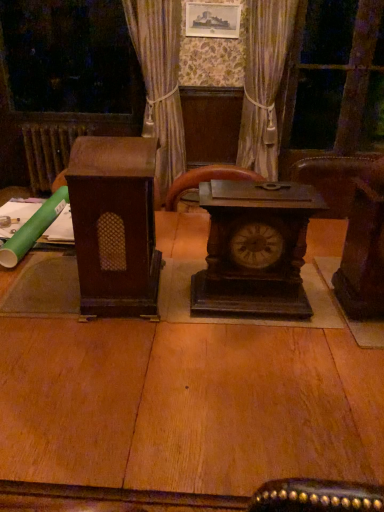
Describe the element at coordinates (353, 226) in the screenshot. I see `dark wood chair at right, the 1th furniture when ordered from right to left` at that location.

The width and height of the screenshot is (384, 512). What do you see at coordinates (49, 150) in the screenshot?
I see `brown wooden radiator at left` at bounding box center [49, 150].

Where is `brown wooden radiator at left`? This screenshot has height=512, width=384. brown wooden radiator at left is located at coordinates [49, 150].

The image size is (384, 512). Describe the element at coordinates (265, 84) in the screenshot. I see `silky beige curtain at center` at that location.

Image resolution: width=384 pixels, height=512 pixels. In order to click on silky beige curtain at center in this screenshot , I will do `click(265, 84)`.

At what (x,y) coordinates should I click in order to perform the action: click on transparent glass door at upper right. Please return your answer as a coordinate pair (x, y). The width and height of the screenshot is (384, 512). Looking at the image, I should click on (330, 72).

The width and height of the screenshot is (384, 512). In order to click on dark brown wood clock at center in this screenshot , I will do `click(254, 249)`.

Choose the correct answer: Is dark wood chair at right, which is counted as the second furniture, starting from the left, inside silky beige curtain at center or outside it?

dark wood chair at right, which is counted as the second furniture, starting from the left, cannot be found inside silky beige curtain at center.

In terms of height, does dark wood chair at right, the 1th furniture when ordered from right to left, look taller or shorter compared to silky beige curtain at center?

dark wood chair at right, the 1th furniture when ordered from right to left, is shorter than silky beige curtain at center.

Can you confirm if dark wood chair at right, the 1th furniture when ordered from right to left, is smaller than silky beige curtain at center?

Correct, dark wood chair at right, the 1th furniture when ordered from right to left, occupies less space than silky beige curtain at center.

Relative to silky beige curtain at center, is dark wood chair at right, which is counted as the second furniture, starting from the left, in front or behind?

dark wood chair at right, which is counted as the second furniture, starting from the left, is positioned closer to the viewer than silky beige curtain at center.

From the image's perspective, which one is positioned higher, dark wood chair at right, the 1th furniture when ordered from right to left, or brown wooden radiator at left?

brown wooden radiator at left.

From the picture: Does dark wood chair at right, the 1th furniture when ordered from right to left, have a smaller size compared to brown wooden radiator at left?

Indeed, dark wood chair at right, the 1th furniture when ordered from right to left, has a smaller size compared to brown wooden radiator at left.

Which of these two, dark wood chair at right, which is counted as the second furniture, starting from the left, or brown wooden radiator at left, is thinner?

With smaller width is dark wood chair at right, which is counted as the second furniture, starting from the left.

Between dark wood chair at right, the 1th furniture when ordered from right to left, and brown wooden radiator at left, which one appears on the right side from the viewer's perspective?

Positioned to the right is dark wood chair at right, the 1th furniture when ordered from right to left.

Which object is thinner, brown wooden radiator at left or dark wood chair at right, the 1th furniture when ordered from right to left?

Thinner between the two is dark wood chair at right, the 1th furniture when ordered from right to left.

How far apart are brown wooden radiator at left and dark wood chair at right, the 1th furniture when ordered from right to left?

brown wooden radiator at left and dark wood chair at right, the 1th furniture when ordered from right to left, are 8.63 feet apart from each other.

Considering the positions of points (31, 125) and (373, 250), is point (31, 125) closer to camera compared to point (373, 250)?

No.

Between brown wooden radiator at left and dark wood chair at right, the 1th furniture when ordered from right to left, which one is positioned behind?

brown wooden radiator at left is more distant.

From a real-world perspective, who is located higher, transparent glass door at upper right or dark wood chair at right, the 1th furniture when ordered from right to left?

dark wood chair at right, the 1th furniture when ordered from right to left.

From the image's perspective, does transparent glass door at upper right appear lower than dark wood chair at right, which is counted as the second furniture, starting from the left?

No, from the image's perspective, transparent glass door at upper right is not below dark wood chair at right, which is counted as the second furniture, starting from the left.

Is transparent glass door at upper right beside dark wood chair at right, the 1th furniture when ordered from right to left?

transparent glass door at upper right and dark wood chair at right, the 1th furniture when ordered from right to left, are not in contact.

The width and height of the screenshot is (384, 512). In order to click on the 1st furniture directly above the transparent glass door at upper right (from a real-world perspective) in this screenshot , I will do `click(353, 226)`.

Is dark brown wood clock at center inside or outside of brown wood speaker at left, the 1th furniture viewed from the left?

dark brown wood clock at center is not inside brown wood speaker at left, the 1th furniture viewed from the left, it's outside.

Considering the relative sizes of dark brown wood clock at center and brown wood speaker at left, which appears as the second furniture when viewed from the right, in the image provided, is dark brown wood clock at center shorter than brown wood speaker at left, which appears as the second furniture when viewed from the right,?

Indeed, dark brown wood clock at center has a lesser height compared to brown wood speaker at left, which appears as the second furniture when viewed from the right.

Based on the photo, from a real-world perspective, is dark brown wood clock at center positioned under brown wood speaker at left, the 1th furniture viewed from the left, based on gravity?

Yes, from a real-world perspective, dark brown wood clock at center is under brown wood speaker at left, the 1th furniture viewed from the left.

In the scene shown: Is dark brown wood clock at center thinner than brown wood speaker at left, the 1th furniture viewed from the left?

Yes, dark brown wood clock at center is thinner than brown wood speaker at left, the 1th furniture viewed from the left.

Which is behind, transparent glass door at upper right or silky beige curtain at center?

transparent glass door at upper right is further from the camera.

Does point (306, 66) come closer to viewer compared to point (287, 79)?

No, (306, 66) is further to viewer.

Identify the location of curtain in front of the transparent glass door at upper right. The width and height of the screenshot is (384, 512). (265, 84).

Looking at this image, is transparent glass door at upper right aimed at silky beige curtain at center?

No, transparent glass door at upper right does not turn towards silky beige curtain at center.

Which of these two, transparent glass door at upper right or brown wooden radiator at left, stands taller?

transparent glass door at upper right.

From a real-world perspective, is transparent glass door at upper right on brown wooden radiator at left?

Indeed, from a real-world perspective, transparent glass door at upper right stands above brown wooden radiator at left.

From the image's perspective, which is below, transparent glass door at upper right or brown wooden radiator at left?

brown wooden radiator at left is shown below in the image.

Locate an element on the screen. The image size is (384, 512). the 1st furniture to the left when counting from the silky beige curtain at center is located at coordinates click(x=353, y=226).

Find the location of a particular element. Image resolution: width=384 pixels, height=512 pixels. radiator that is behind the dark wood chair at right, which is counted as the second furniture, starting from the left is located at coordinates (49, 150).

When comparing their distances from dark wood chair at right, which is counted as the second furniture, starting from the left, does silky beige curtain at center or transparent glass door at upper right seem further?

transparent glass door at upper right is further to dark wood chair at right, which is counted as the second furniture, starting from the left.

Looking at the image, which one is located further to transparent glass door at upper right, brown wooden radiator at left or silky beige curtain at center?

Among the two, brown wooden radiator at left is located further to transparent glass door at upper right.

In the scene shown: Looking at the image, which one is located further to silky beige curtain at center, dark brown wood clock at center or dark wood chair at right, the 1th furniture when ordered from right to left?

dark brown wood clock at center.

Which object lies further to the anchor point silky beige curtain at center, brown wooden radiator at left or dark brown wood clock at center?

dark brown wood clock at center lies further to silky beige curtain at center than the other object.

When comparing their distances from silky beige curtain at center, does brown wood speaker at left, the 1th furniture viewed from the left, or transparent glass door at upper right seem further?

brown wood speaker at left, the 1th furniture viewed from the left.

From the image, which object appears to be nearer to dark wood chair at right, which is counted as the second furniture, starting from the left, dark brown wood clock at center or brown wood speaker at left, which appears as the second furniture when viewed from the right?

dark brown wood clock at center.

Looking at the image, which one is located closer to transparent glass door at upper right, dark brown wood clock at center or brown wood speaker at left, the 1th furniture viewed from the left?

Among the two, dark brown wood clock at center is located nearer to transparent glass door at upper right.

Looking at this image, estimate the real-world distances between objects in this image. Which object is closer to silky beige curtain at center, dark brown wood clock at center or brown wood speaker at left, which appears as the second furniture when viewed from the right?

dark brown wood clock at center lies closer to silky beige curtain at center than the other object.

In order to click on glass door between brown wood speaker at left, the 1th furniture viewed from the left, and brown wooden radiator at left from front to back in this screenshot , I will do `click(330, 72)`.

This screenshot has width=384, height=512. What are the coordinates of `curtain between brown wood speaker at left, which appears as the second furniture when viewed from the right, and transparent glass door at upper right, along the z-axis` in the screenshot? It's located at (265, 84).

This screenshot has width=384, height=512. What are the coordinates of `curtain between dark brown wood clock at center and brown wooden radiator at left from front to back` in the screenshot? It's located at (265, 84).

Where is `curtain situated between brown wooden radiator at left and transparent glass door at upper right from left to right`? This screenshot has width=384, height=512. curtain situated between brown wooden radiator at left and transparent glass door at upper right from left to right is located at coordinates (265, 84).